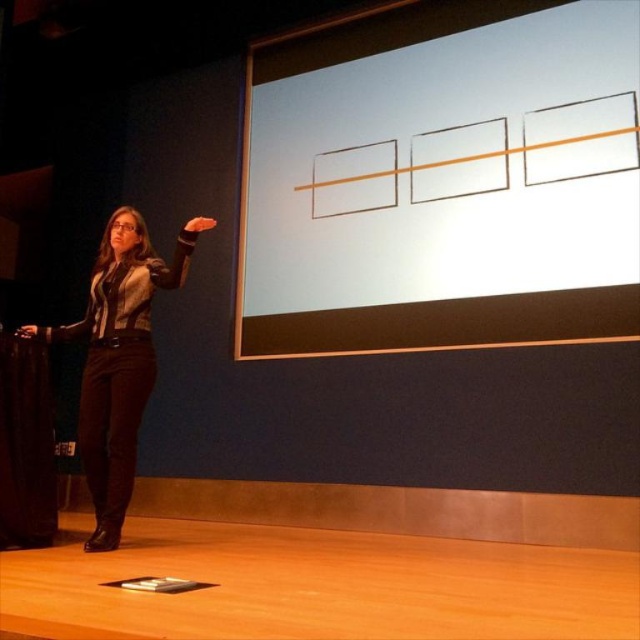
Question: Can you confirm if white matte projection screen at upper center is positioned to the left of black leather pants at lower left?

Choices:
 (A) no
 (B) yes

Answer: (A)

Question: Among these points, which one is nearest to the camera?

Choices:
 (A) pos(284,90)
 (B) pos(129,285)

Answer: (B)

Question: Is white matte projection screen at upper center to the left of black leather pants at lower left from the viewer's perspective?

Choices:
 (A) no
 (B) yes

Answer: (A)

Question: Where is white matte projection screen at upper center located in relation to black leather pants at lower left in the image?

Choices:
 (A) below
 (B) above

Answer: (B)